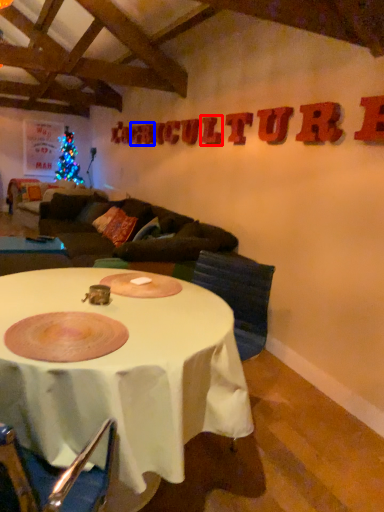
Question: Which object appears closest to the camera in this image, letter (highlighted by a red box) or letter (highlighted by a blue box)?

Choices:
 (A) letter
 (B) letter

Answer: (A)